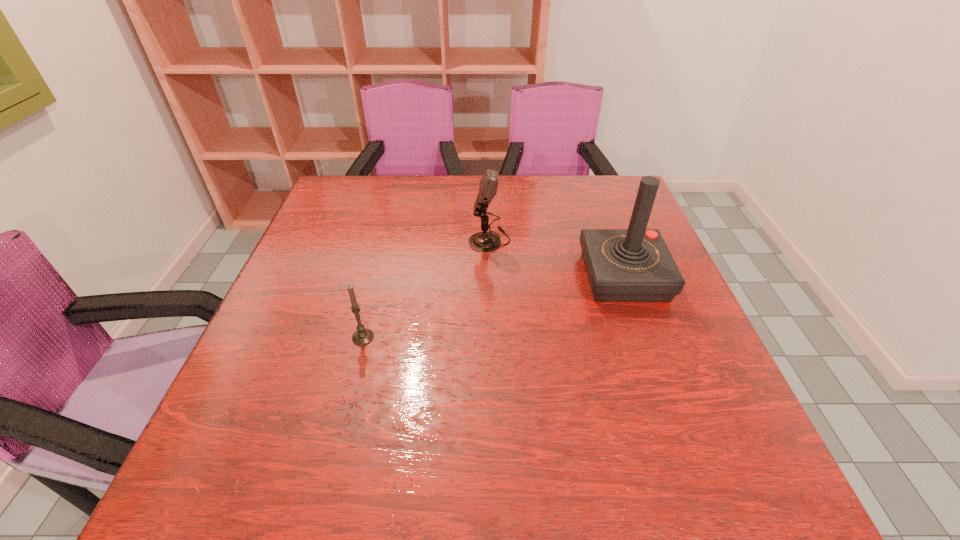
Find the location of a particular element. The width and height of the screenshot is (960, 540). vacant space located on the front-facing side of the second object from right to left is located at coordinates (420, 240).

Identify the location of free space located on the front-facing side of the second object from right to left. (374, 240).

At what (x,y) coordinates should I click in order to perform the action: click on free space located 0.270m on the back of the shortest object. Please return your answer as a coordinate pair (x, y). This screenshot has width=960, height=540. Looking at the image, I should click on (385, 250).

I want to click on object that is at the right edge, so click(x=623, y=265).

The height and width of the screenshot is (540, 960). I want to click on free space at the far edge of the desktop, so click(468, 198).

Identify the location of free region at the near edge. This screenshot has height=540, width=960. (600, 471).

Identify the location of vacant region at the left edge. (363, 248).

Find the location of `vacant space at the right edge of the desktop`. vacant space at the right edge of the desktop is located at coordinates (678, 306).

You are a GUI agent. You are given a task and a screenshot of the screen. Output one action in this format:
    pyautogui.click(x=<x>, y=<y>)
    Task: Click on the vacant space at the far left corner
    This screenshot has height=540, width=960.
    Given the screenshot: What is the action you would take?
    pyautogui.click(x=332, y=185)

At what (x,y) coordinates should I click in order to perform the action: click on vacant space at the near left corner of the desktop. Please return your answer as a coordinate pair (x, y). Looking at the image, I should click on (261, 467).